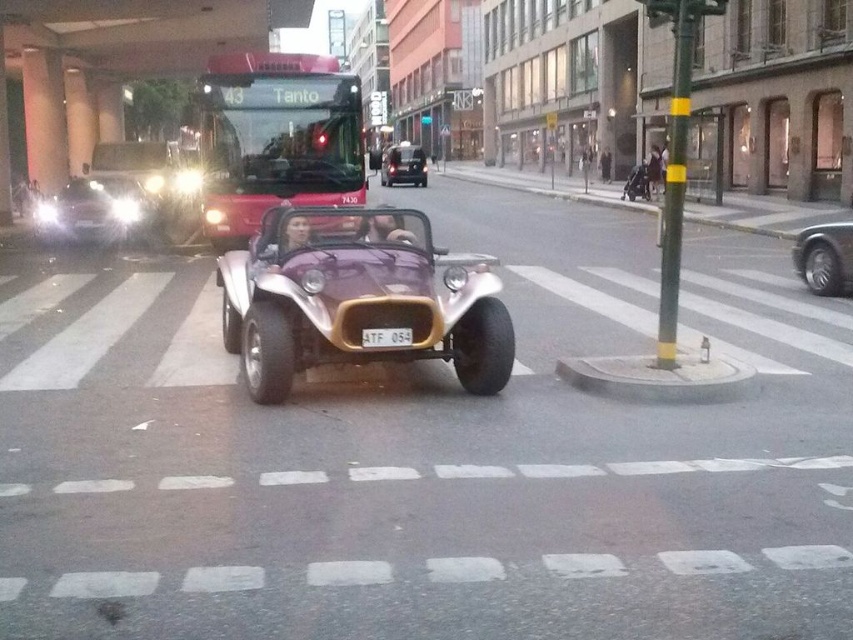
What are the coordinates of `shiny black car at center` in the screenshot? It's located at (824, 257).

Can you confirm if metallic red bus at center is shorter than shiny silver car at left?

In fact, metallic red bus at center may be taller than shiny silver car at left.

Can you confirm if metallic red bus at center is bigger than shiny silver car at left?

Yes, metallic red bus at center is bigger than shiny silver car at left.

Between point (329, 88) and point (91, 212), which one is positioned behind?

Point (91, 212)

Locate an element on the screen. metallic red bus at center is located at coordinates (276, 138).

Is point (311, 324) positioned after point (374, 328)?

That is True.

What do you see at coordinates (357, 298) in the screenshot? Image resolution: width=853 pixels, height=640 pixels. I see `purple metallic car at center` at bounding box center [357, 298].

Identify the location of purple metallic car at center. (357, 298).